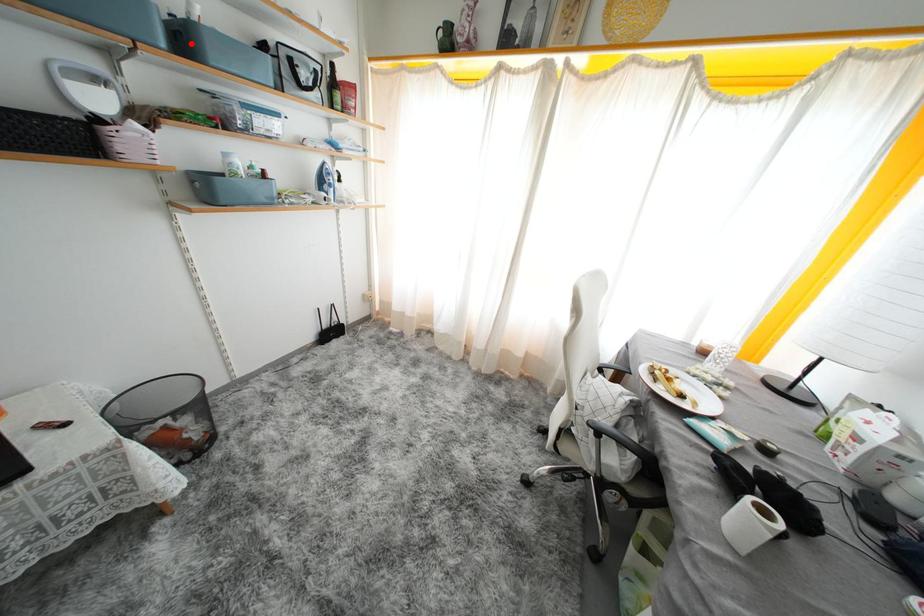
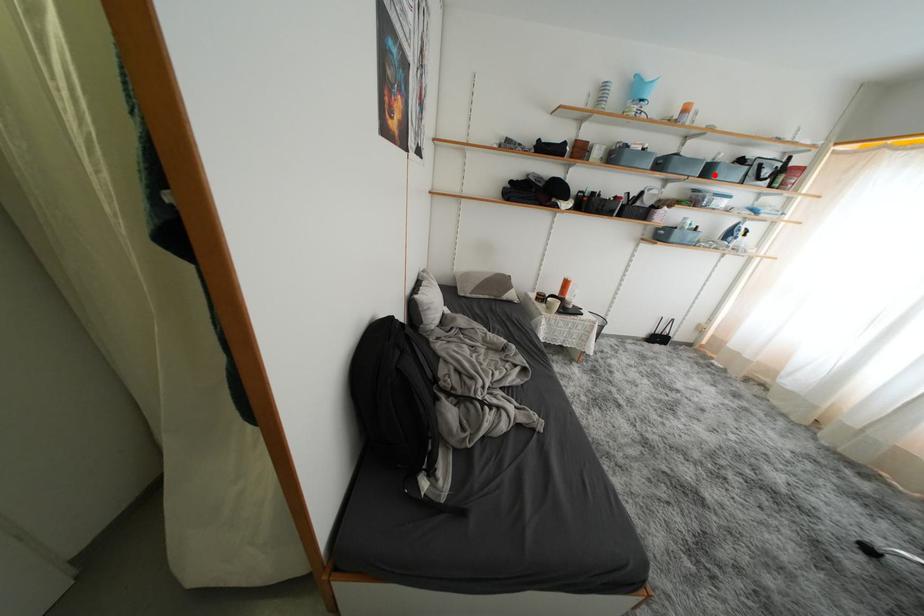
I am providing you with two images of the same scene from different viewpoints. A red point is marked on the first image and another point is marked on the second image. Does the point marked in image1 correspond to the same location as the one in image2?

Yes